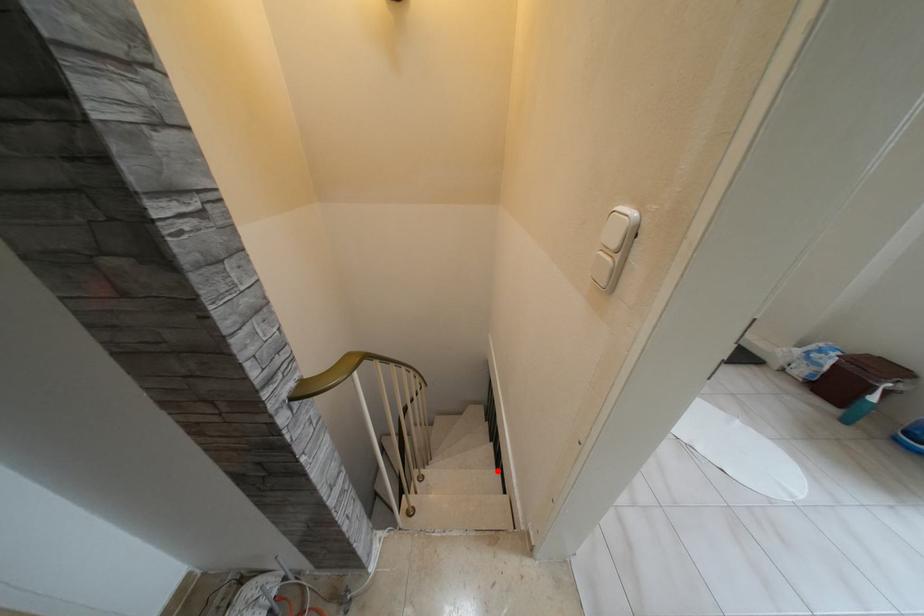
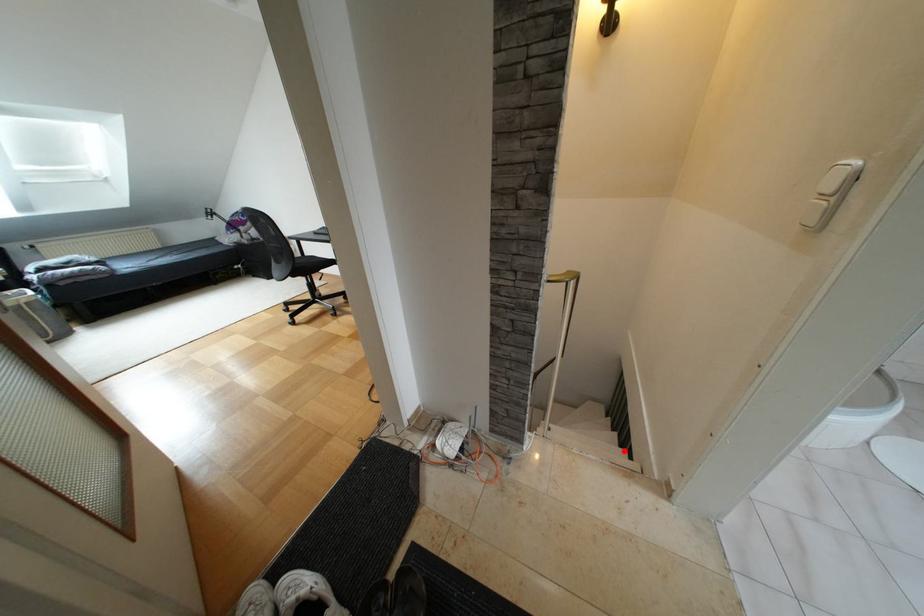
I am providing you with two images of the same scene from different viewpoints. A red point is marked on the first image and another point is marked on the second image. Do the highlighted points in image1 and image2 indicate the same real-world spot?

Yes